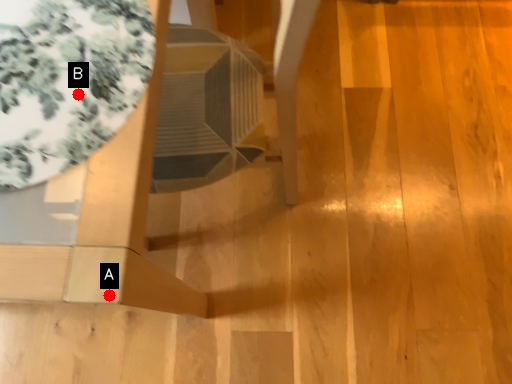
Question: Two points are circled on the image, labeled by A and B beside each circle. Which point is farther from the camera taking this photo?

Choices:
 (A) A is further
 (B) B is further

Answer: (B)